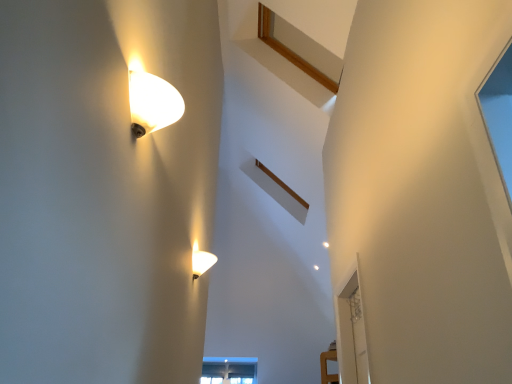
Question: Considering the relative sizes of matte glass lamp at upper left, the second lamp positioned from the back, and transparent glass door at right in the image provided, is matte glass lamp at upper left, the second lamp positioned from the back, smaller than transparent glass door at right?

Choices:
 (A) no
 (B) yes

Answer: (B)

Question: Can we say matte glass lamp at upper left, the second lamp positioned from the back, lies outside transparent glass door at right?

Choices:
 (A) yes
 (B) no

Answer: (A)

Question: From a real-world perspective, is matte glass lamp at upper left, which ranks as the second lamp in bottom-to-top order, physically below transparent glass door at right?

Choices:
 (A) yes
 (B) no

Answer: (B)

Question: From a real-world perspective, is matte glass lamp at upper left, the second lamp positioned from the back, physically above transparent glass door at right?

Choices:
 (A) no
 (B) yes

Answer: (B)

Question: Is matte glass lamp at upper left, which is the 1th lamp in front-to-back order, behind transparent glass door at right?

Choices:
 (A) no
 (B) yes

Answer: (A)

Question: Is transparent glass door at right shorter than matte glass lamp at upper left, which ranks as the second lamp in bottom-to-top order?

Choices:
 (A) yes
 (B) no

Answer: (B)

Question: Is the depth of transparent glass door at right greater than that of matte glass lamp at upper left, marked as the 1th lamp in a top-to-bottom arrangement?

Choices:
 (A) no
 (B) yes

Answer: (B)

Question: From a real-world perspective, is transparent glass door at right physically above matte glass lamp at upper left, marked as the 1th lamp in a top-to-bottom arrangement?

Choices:
 (A) yes
 (B) no

Answer: (B)

Question: Is transparent glass door at right next to matte glass lamp at upper left, which ranks as the second lamp in bottom-to-top order?

Choices:
 (A) yes
 (B) no

Answer: (B)

Question: Is there a large distance between transparent glass door at right and matte glass lamp at upper left, marked as the 1th lamp in a top-to-bottom arrangement?

Choices:
 (A) yes
 (B) no

Answer: (A)

Question: Does transparent glass door at right appear on the right side of matte glass lamp at upper left, the second lamp positioned from the back?

Choices:
 (A) yes
 (B) no

Answer: (A)

Question: Is matte white lamp at lower center, placed as the 1th lamp when sorted from back to front, behind transparent glass door at right?

Choices:
 (A) yes
 (B) no

Answer: (B)